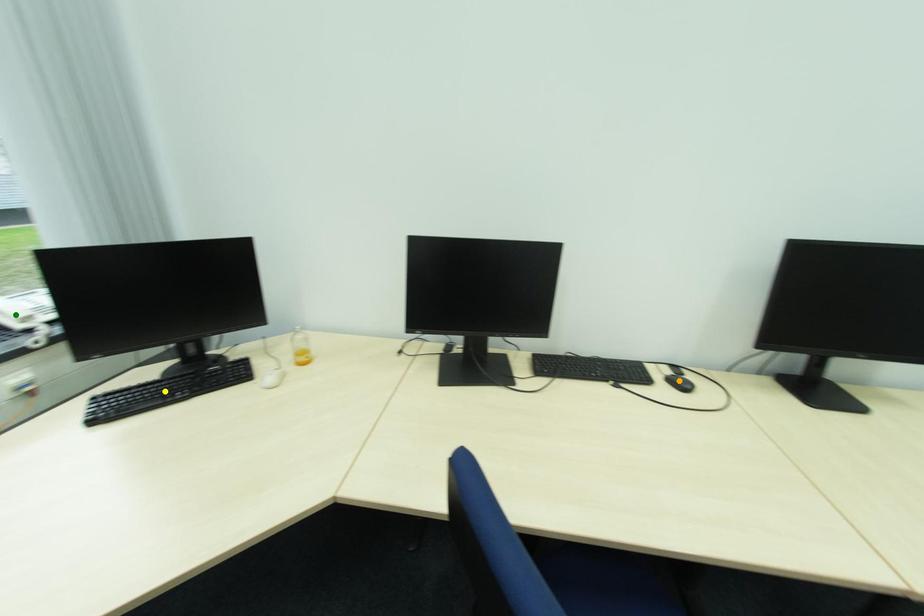
Order these from nearest to farthest:
- green point
- orange point
- yellow point

yellow point
orange point
green point